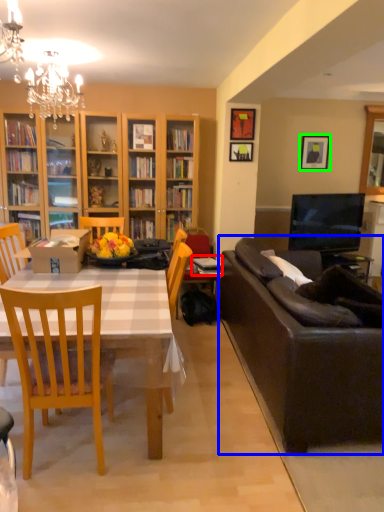
Question: Which is nearer to the book (highlighted by a red box)? studio couch (highlighted by a blue box) or picture frame (highlighted by a green box).

Choices:
 (A) studio couch
 (B) picture frame

Answer: (A)